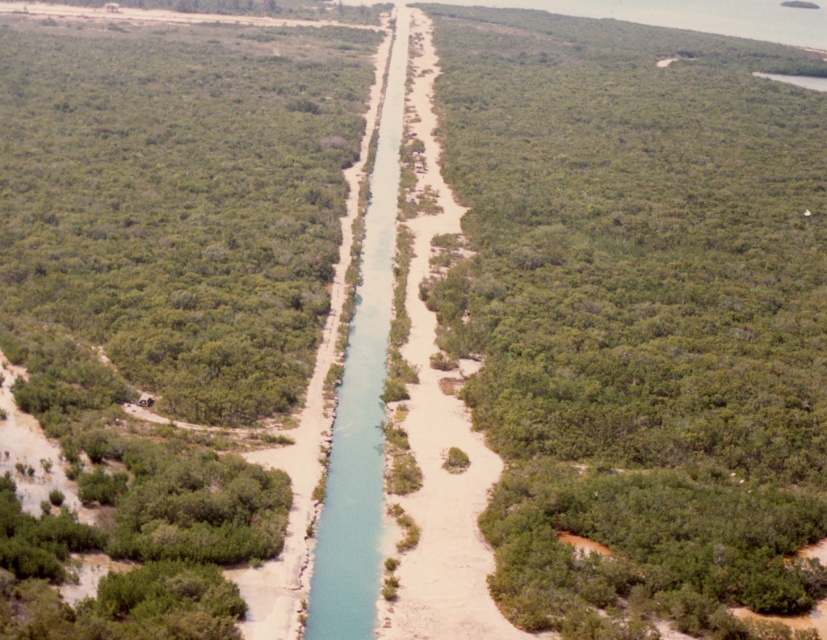
Question: Can you confirm if green leafy shrubs at center is wider than blue smooth waterway at center?

Choices:
 (A) yes
 (B) no

Answer: (A)

Question: Which point is closer to the camera?

Choices:
 (A) green leafy shrubs at center
 (B) blue smooth waterway at center

Answer: (A)

Question: Which object is the closest to the green leafy vegetation at center?

Choices:
 (A) blue smooth waterway at center
 (B) green leafy shrubs at center

Answer: (A)

Question: Is green leafy vegetation at center wider than blue smooth waterway at center?

Choices:
 (A) yes
 (B) no

Answer: (A)

Question: Is green leafy vegetation at center bigger than blue smooth waterway at center?

Choices:
 (A) yes
 (B) no

Answer: (A)

Question: Which object is closer to the camera taking this photo?

Choices:
 (A) blue smooth waterway at center
 (B) green leafy shrubs at center

Answer: (B)